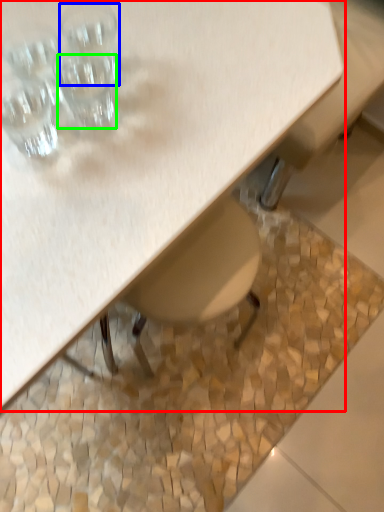
Question: Which object is the closest to the table (highlighted by a red box)? Choose among these: shot glass (highlighted by a blue box) or shot glass (highlighted by a green box).

Choices:
 (A) shot glass
 (B) shot glass

Answer: (B)